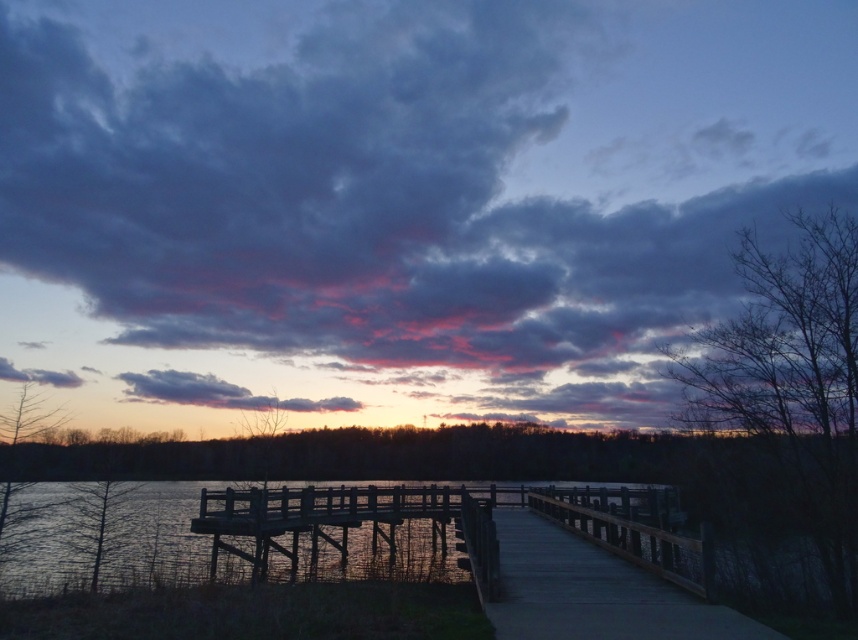
Who is more forward, (654, 596) or (234, 529)?

Point (654, 596) is more forward.

Is smooth concrete walkway at center shorter than wooden dock at center?

Yes, smooth concrete walkway at center is shorter than wooden dock at center.

Between point (660, 589) and point (340, 522), which one is positioned behind?

The point (340, 522) is more distant.

Identify the location of smooth concrete walkway at center. (594, 593).

Who is lower down, purple matte cloud at upper center or dark wood water at lower left?

Positioned lower is dark wood water at lower left.

Which is behind, point (660, 266) or point (245, 509)?

Positioned behind is point (660, 266).

Image resolution: width=858 pixels, height=640 pixels. In order to click on purple matte cloud at upper center in this screenshot , I will do `click(396, 200)`.

Which is in front, point (385, 42) or point (228, 515)?

Point (228, 515) is in front.

Between purple matte cloud at upper center and wooden dock at center, which one has more height?

Standing taller between the two is purple matte cloud at upper center.

Which is behind, point (690, 81) or point (354, 499)?

Positioned behind is point (690, 81).

You are a GUI agent. You are given a task and a screenshot of the screen. Output one action in this format:
    pyautogui.click(x=<x>, y=<y>)
    Task: Click on the purple matte cloud at upper center
    The image size is (858, 640).
    Given the screenshot: What is the action you would take?
    pyautogui.click(x=396, y=200)